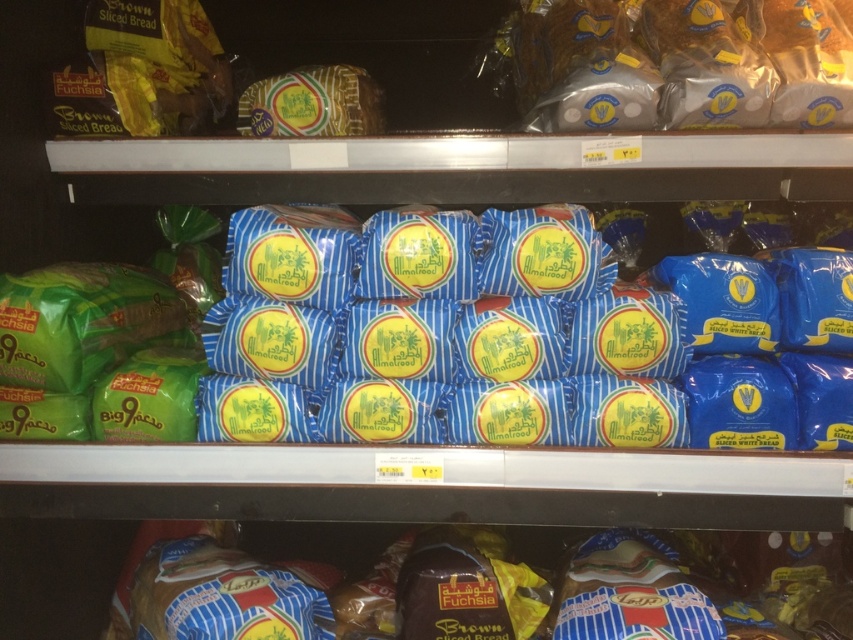
You are a customer looking to buy bread. You see the golden brown bread at upper right and the brown textured bread at lower center. Which one is larger in size?

The golden brown bread at upper right is bigger than the brown textured bread at lower center.